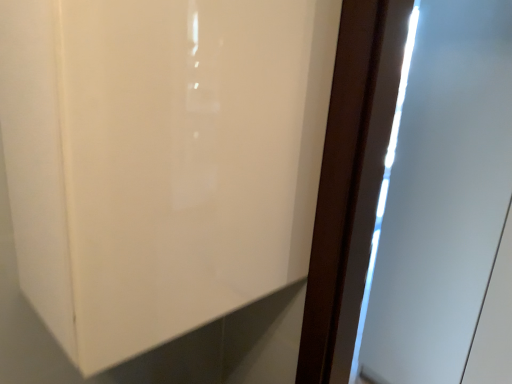
What do you see at coordinates (446, 206) in the screenshot? This screenshot has width=512, height=384. I see `white glossy screen door at right` at bounding box center [446, 206].

Where is `white glossy screen door at right`? Image resolution: width=512 pixels, height=384 pixels. white glossy screen door at right is located at coordinates (446, 206).

Locate an element on the screen. This screenshot has height=384, width=512. white glossy screen door at right is located at coordinates (446, 206).